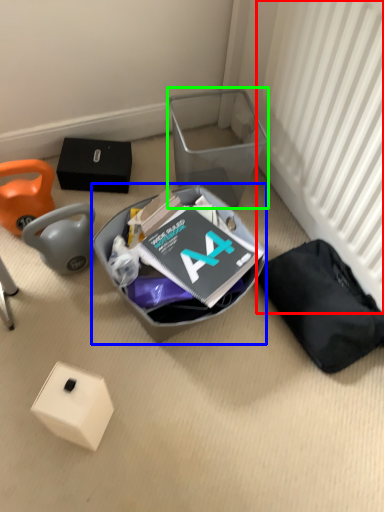
Question: Based on their relative distances, which object is farther from radiator (highlighted by a red box)? Choose from waste (highlighted by a blue box) and shoe box (highlighted by a green box).

Choices:
 (A) waste
 (B) shoe box

Answer: (A)